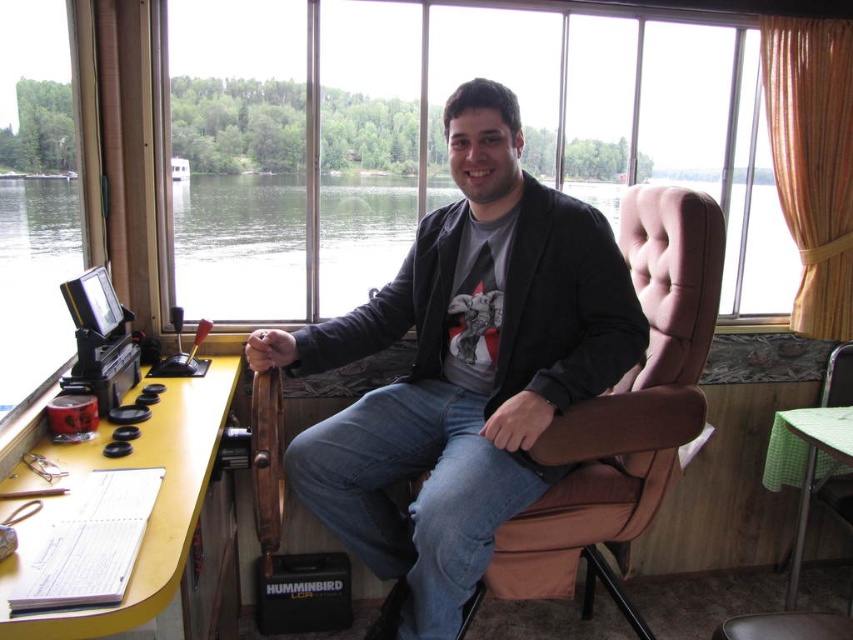
Which of these two, matte black jacket at center or transparent glass water at center, stands taller?

matte black jacket at center

Does point (416, 269) lie in front of point (230, 330)?

Yes.

At what (x,y) coordinates should I click in order to perform the action: click on matte black jacket at center. Please return your answer as a coordinate pair (x, y). Looking at the image, I should click on (463, 365).

Can you confirm if yellow wood table at lower left is positioned below green checkered table at lower right?

Actually, yellow wood table at lower left is above green checkered table at lower right.

Between yellow wood table at lower left and green checkered table at lower right, which one is positioned lower?

green checkered table at lower right is below.

Is point (142, 428) positioned in front of point (780, 417)?

Yes, point (142, 428) is in front of point (780, 417).

Where is `yellow wood table at lower left`? The image size is (853, 640). yellow wood table at lower left is located at coordinates (151, 509).

Based on the photo, can you confirm if transparent glass water at center is thinner than green checkered table at lower right?

Yes.

Does point (354, 387) lie in front of point (843, 440)?

That is False.

This screenshot has height=640, width=853. I want to click on transparent glass water at center, so click(x=752, y=358).